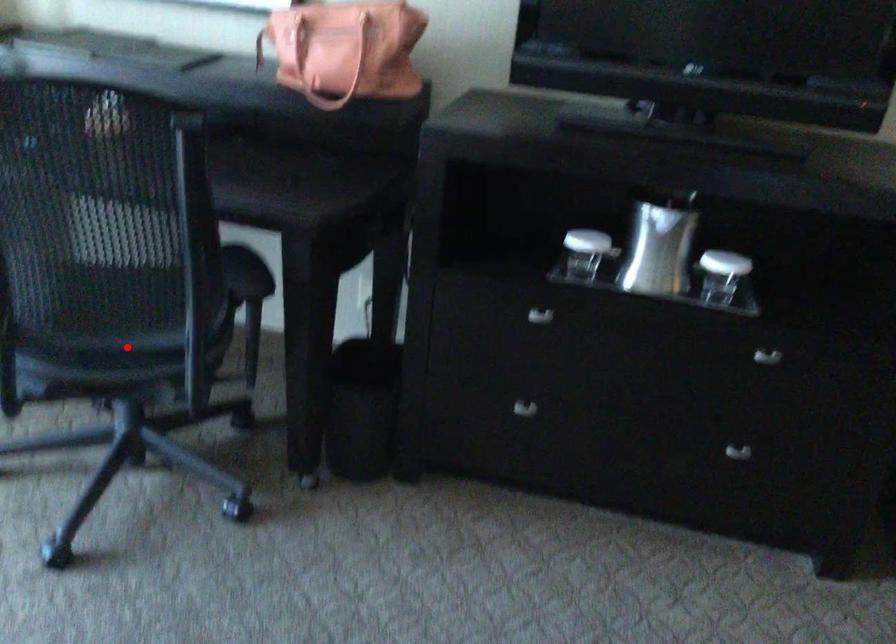
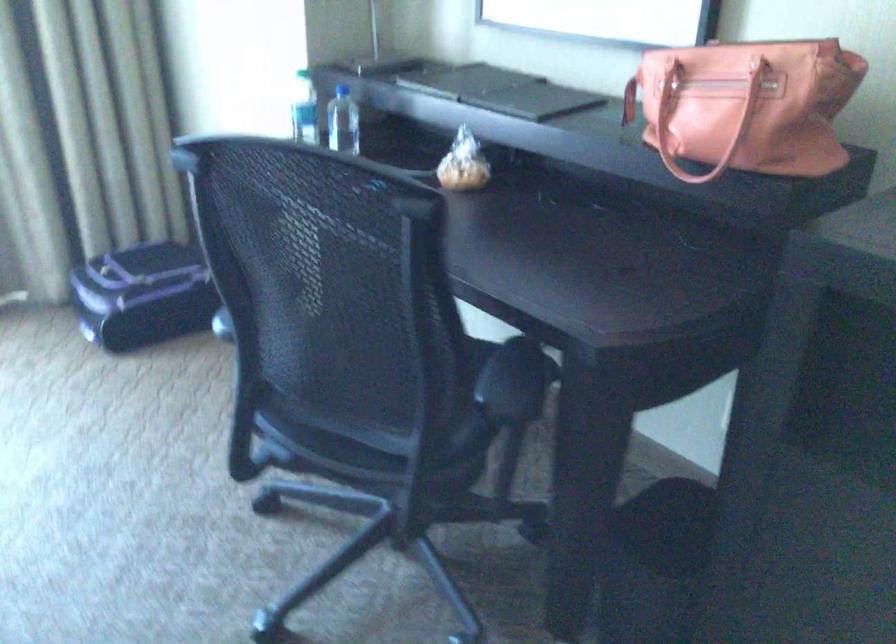
Question: I am providing you with two images of the same scene from different viewpoints. A red point is shown in image1. For the corresponding object point in image2, is it positioned nearer or farther from the camera?

Choices:
 (A) Nearer
 (B) Farther

Answer: (A)